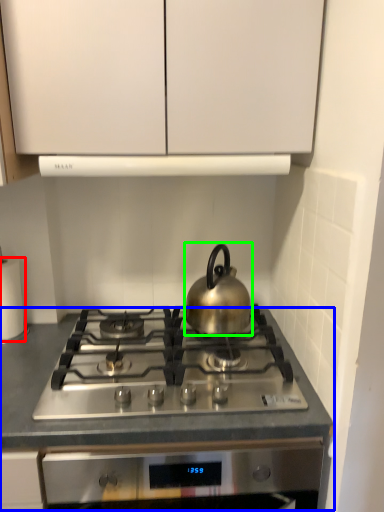
Question: Which object is positioned closest to paper towel (highlighted by a red box)? Select from counter (highlighted by a blue box) and kettle (highlighted by a green box).

Choices:
 (A) counter
 (B) kettle

Answer: (A)